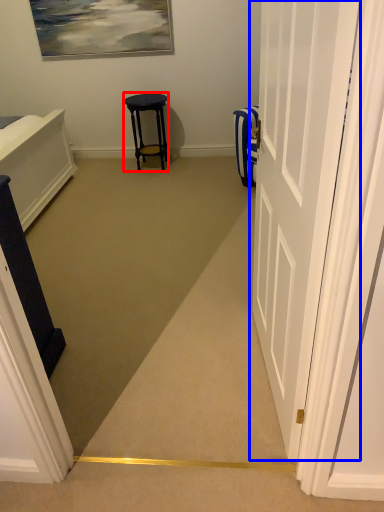
Question: Among these objects, which one is nearest to the camera, stool (highlighted by a red box) or door (highlighted by a blue box)?

Choices:
 (A) stool
 (B) door

Answer: (B)